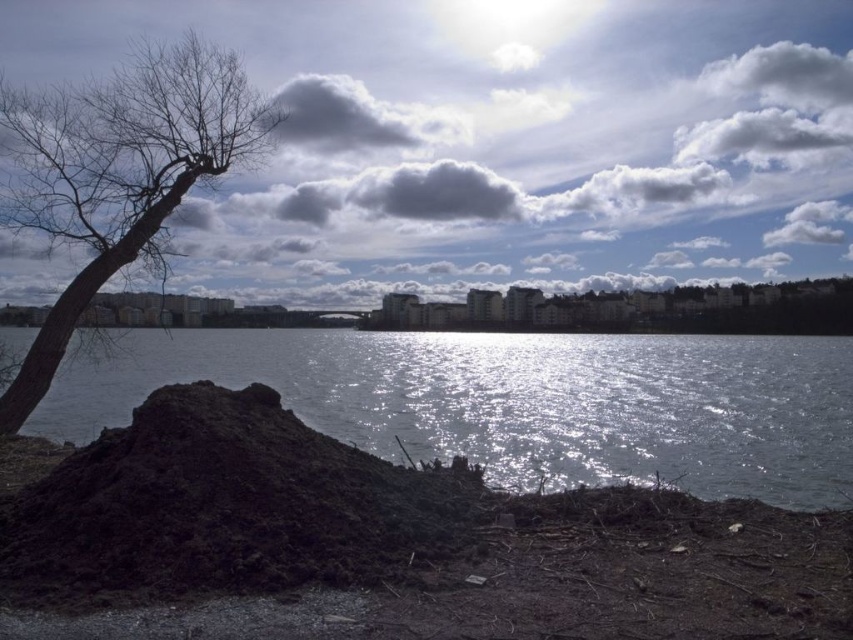
Does dark soil mound at lower left have a larger size compared to bare wood tree at left?

Actually, dark soil mound at lower left might be smaller than bare wood tree at left.

Which is more to the right, dark soil mound at lower left or bare wood tree at left?

Positioned to the right is dark soil mound at lower left.

Does point (350, 522) come in front of point (38, 332)?

Yes, point (350, 522) is in front of point (38, 332).

Find the location of `dark soil mound at lower left`. dark soil mound at lower left is located at coordinates (224, 506).

Who is more forward, (403, 429) or (28, 564)?

Positioned in front is point (28, 564).

Is glistening water at center taller than dark soil mound at lower left?

Yes, glistening water at center is taller than dark soil mound at lower left.

You are a GUI agent. You are given a task and a screenshot of the screen. Output one action in this format:
    pyautogui.click(x=<x>, y=<y>)
    Task: Click on the glistening water at center
    Image resolution: width=853 pixels, height=640 pixels.
    Given the screenshot: What is the action you would take?
    pyautogui.click(x=520, y=401)

Is cloudy sky at upper center above bare wood tree at left?

Yes.

Does point (842, 140) come in front of point (80, 161)?

That is False.

The image size is (853, 640). What are the coordinates of `cloudy sky at upper center` in the screenshot? It's located at (502, 140).